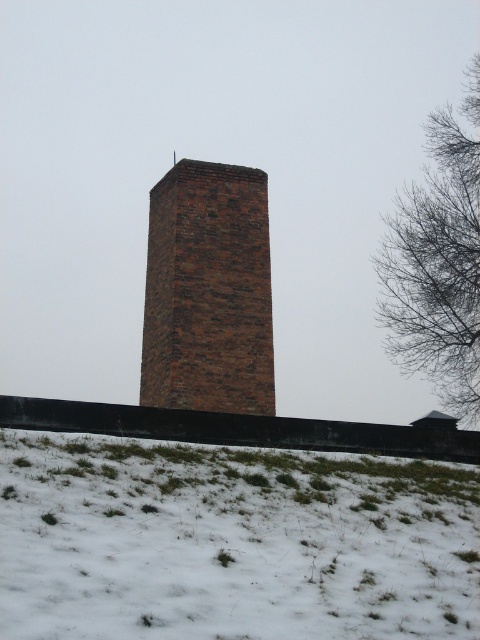
You are standing at the base of the brick tower and looking towards the top. There are two points marked on the tower, point (4, 524) and point (245, 218). Which point is closer to you?

Point (4, 524) is closer to the viewer than point (245, 218).

You are standing at the base of the brick tower and want to place a small decorative snowman exactly where the white fluffy snow at lower center is located. According to the image, what are the coordinates of the spot where you should build the snowman?

The coordinates for the white fluffy snow at lower center are 0.847 on the x axis and 0.483 on the y axis. So you should build the snowman at point (231,541).

You are standing at the base of the brick tower and want to take a photo of the brick chimney at center and the bare branches at upper right. Which object should you pan your camera to the right to include in the frame first?

You should pan your camera to the right to include the bare branches at upper right first because the brick chimney at center is to the left of bare branches at upper right.